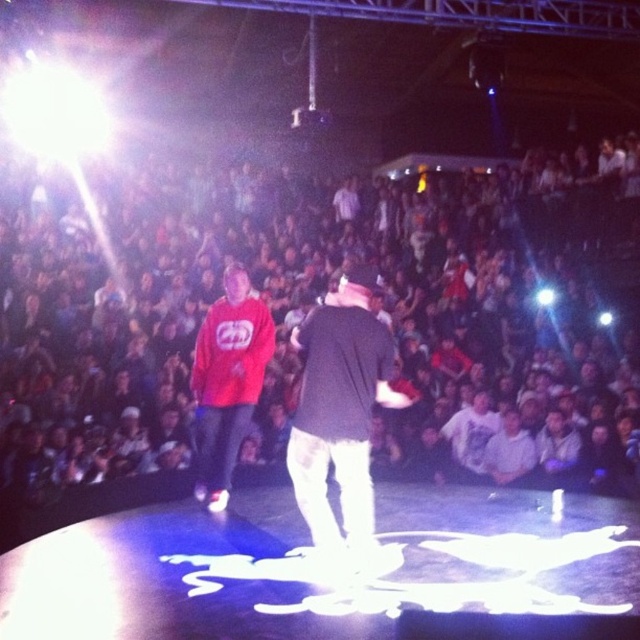
Between point (460, 348) and point (225, 406), which one is positioned behind?

Point (460, 348)

Is point (538, 387) behind point (220, 316)?

Yes, it is behind point (220, 316).

Where is `dark clothing audience at center`? This screenshot has width=640, height=640. dark clothing audience at center is located at coordinates (317, 301).

Measure the distance between point (317,252) and camera.

Point (317,252) and camera are 14.47 meters apart.

Is dark clothing audience at center positioned in front of black matte jacket at center?

No, dark clothing audience at center is further to the viewer.

You are a GUI agent. You are given a task and a screenshot of the screen. Output one action in this format:
    pyautogui.click(x=<x>, y=<y>)
    Task: Click on the dark clothing audience at center
    The image size is (640, 640).
    Given the screenshot: What is the action you would take?
    pyautogui.click(x=317, y=301)

Is black matte jacket at center to the left of matte red hoodie at center from the viewer's perspective?

Incorrect, black matte jacket at center is not on the left side of matte red hoodie at center.

Measure the distance from black matte jacket at center to matte red hoodie at center.

They are 6.15 feet apart.

The width and height of the screenshot is (640, 640). I want to click on black matte jacket at center, so click(340, 410).